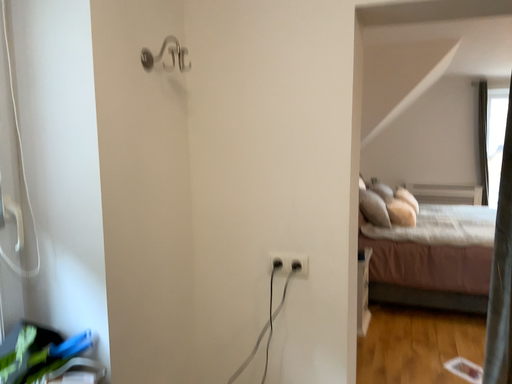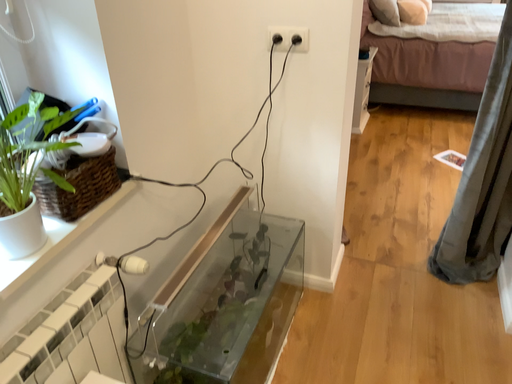
Question: How did the camera likely rotate when shooting the video?

Choices:
 (A) rotated upward
 (B) rotated downward

Answer: (B)